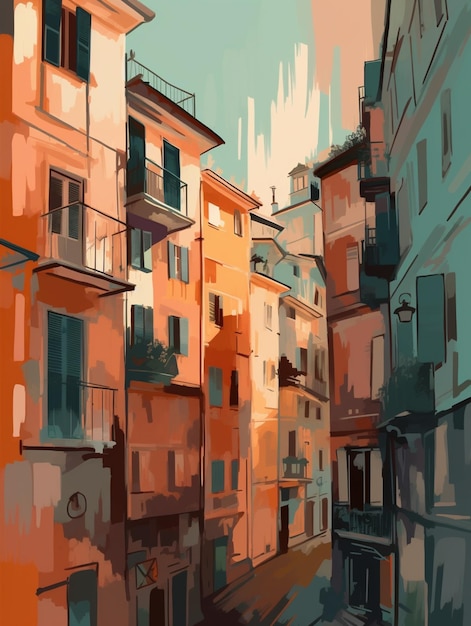
Image resolution: width=471 pixels, height=626 pixels. In order to click on windows in this screenshot , I will do pos(266,317), pos(175,262), pos(238,225), pos(178,340), pos(179,471), pos(146,474), pos(447,156), pos(419,177).